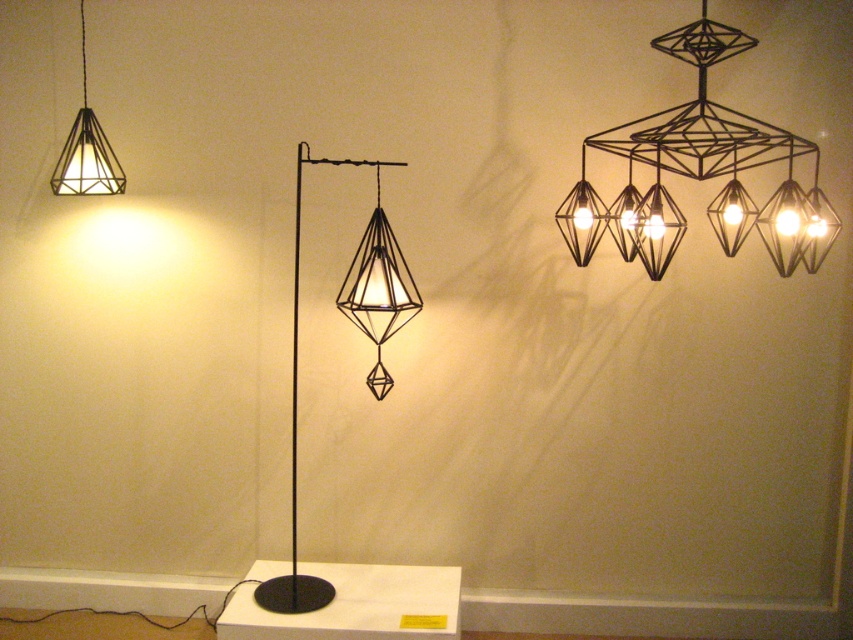
Question: Which object is the farthest from the matte black geometric lamp at center?

Choices:
 (A) black wireframe chandelier at upper right
 (B) matte black geometric lamp at upper left

Answer: (B)

Question: Is matte black geometric lamp at center wider than matte black geometric lamp at upper left?

Choices:
 (A) yes
 (B) no

Answer: (A)

Question: Does matte black geometric lamp at center have a larger size compared to matte black geometric lamp at upper left?

Choices:
 (A) no
 (B) yes

Answer: (B)

Question: Can you confirm if black wireframe chandelier at upper right is positioned below matte black geometric lamp at center?

Choices:
 (A) yes
 (B) no

Answer: (B)

Question: Which point appears closest to the camera in this image?

Choices:
 (A) (375, 333)
 (B) (97, 156)
 (C) (767, 236)

Answer: (B)

Question: Which is nearer to the matte black geometric lamp at upper left?

Choices:
 (A) matte black floor lamp at center
 (B) black wireframe chandelier at upper right
 (C) matte black geometric lamp at center

Answer: (A)